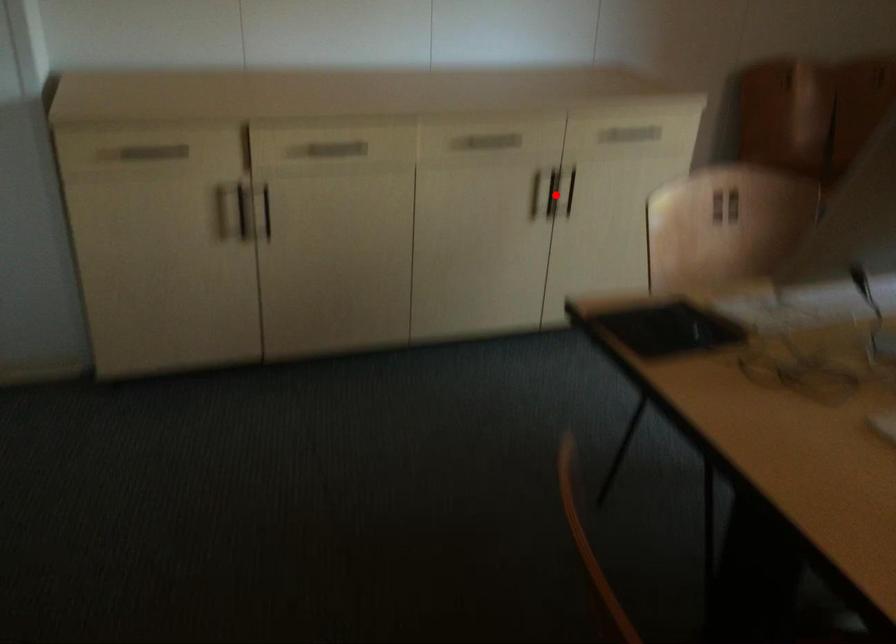
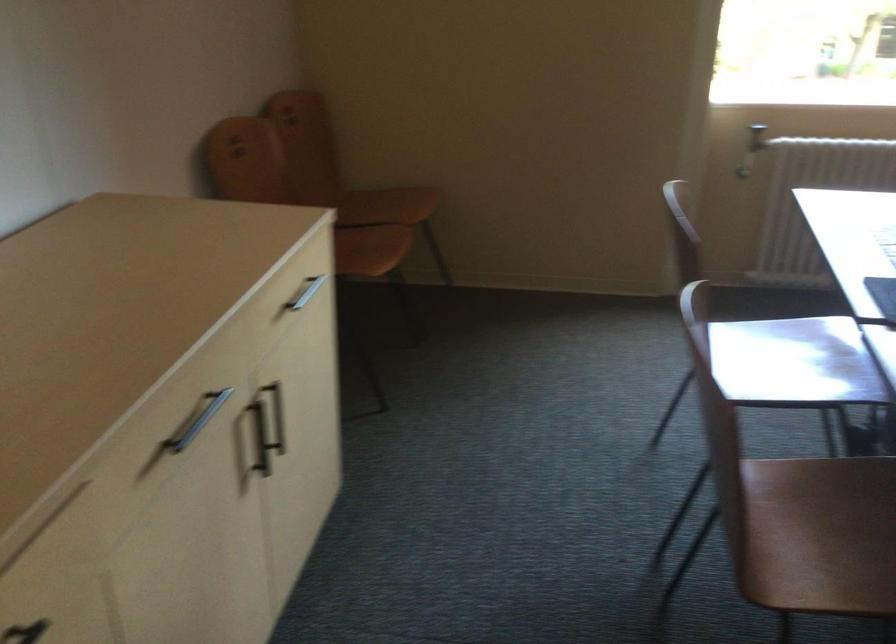
The point at the highlighted location is marked in the first image. Where is the corresponding point in the second image?

(260, 438)